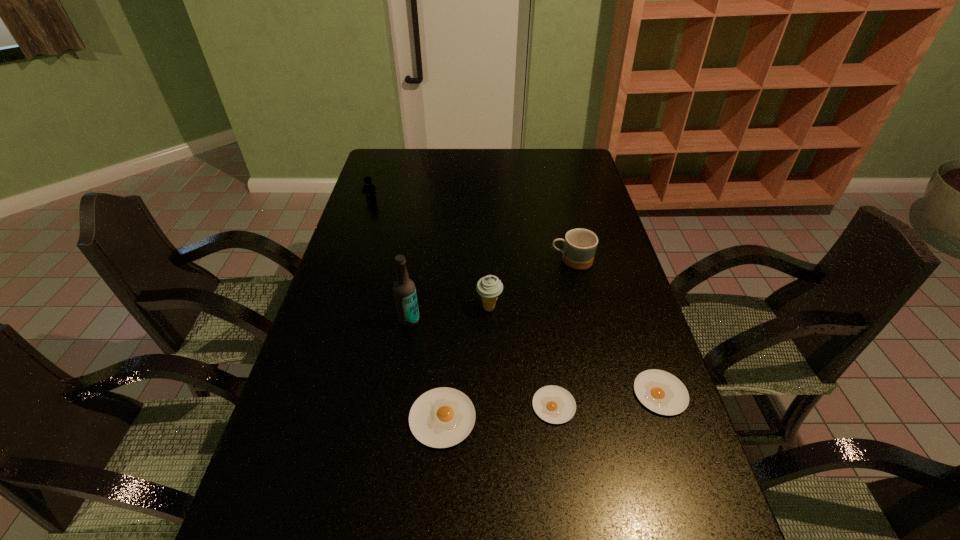
At what (x,y) coordinates should I click in order to perform the action: click on free location located 0.260m on the label of the beer bottle. Please return your answer as a coordinate pair (x, y). Looking at the image, I should click on (395, 416).

This screenshot has height=540, width=960. Identify the location of object at the left edge. (369, 188).

The image size is (960, 540). Find the location of `egg yolk positioned at the right edge`. egg yolk positioned at the right edge is located at coordinates (661, 392).

Locate an element on the screen. This screenshot has height=540, width=960. mug located at the right edge is located at coordinates (580, 245).

Image resolution: width=960 pixels, height=540 pixels. I want to click on free space at the far edge, so click(x=497, y=150).

Image resolution: width=960 pixels, height=540 pixels. Identify the location of free spot at the left edge of the desktop. (382, 180).

Where is `free point at the right edge`? free point at the right edge is located at coordinates (600, 289).

This screenshot has height=540, width=960. Find the location of `vacant space at the near left corner`. vacant space at the near left corner is located at coordinates (259, 516).

Identify the location of free space at the far right corner of the desktop. The image size is (960, 540). (589, 166).

The width and height of the screenshot is (960, 540). In order to click on free point between the leftmost object and the rightmost object in this screenshot , I will do `click(516, 296)`.